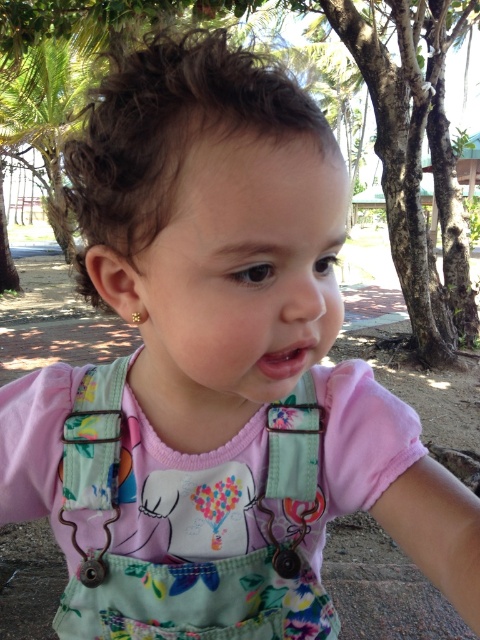
Can you confirm if floral fabric overalls at center is thinner than floral fabric strap at center?

No.

Which is more to the right, floral fabric overalls at center or floral fabric strap at center?

floral fabric strap at center is more to the right.

Who is more forward, (x=110, y=461) or (x=304, y=413)?

Point (x=110, y=461) is more forward.

What are the coordinates of `floral fabric overalls at center` in the screenshot? It's located at (188, 557).

Locate an element on the screen. Image resolution: width=480 pixels, height=640 pixels. metallic fabric strap at lower left is located at coordinates (94, 458).

Does point (123, 376) lie in front of point (312, 506)?

That is False.

Is point (82, 394) positioned before point (269, 420)?

No, (82, 394) is behind (269, 420).

Identify the location of metallic fabric strap at lower left. The image size is (480, 640). (94, 458).

Which of these two, floral fabric overalls at center or metallic fabric strap at lower left, stands taller?

floral fabric overalls at center is taller.

Which of these two, floral fabric overalls at center or metallic fabric strap at lower left, stands shorter?

Standing shorter between the two is metallic fabric strap at lower left.

Locate an element on the screen. floral fabric overalls at center is located at coordinates (188, 557).